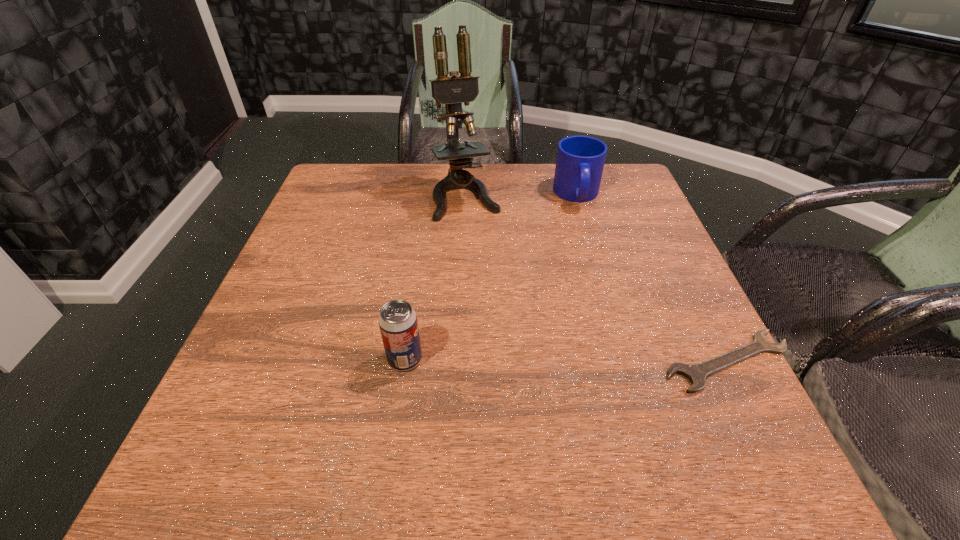
Where is `vacant position located 0.120m on the side with the handle of the second object from right to left`? The height and width of the screenshot is (540, 960). vacant position located 0.120m on the side with the handle of the second object from right to left is located at coordinates (587, 242).

Locate an element on the screen. The height and width of the screenshot is (540, 960). vacant position located 0.180m on the side with the handle of the second object from right to left is located at coordinates [x=589, y=259].

Where is `vacant position located 0.060m on the side with the handle of the second object from right to left`? This screenshot has width=960, height=540. vacant position located 0.060m on the side with the handle of the second object from right to left is located at coordinates (584, 227).

What are the coordinates of `microscope at the far edge` in the screenshot? It's located at (452, 91).

Locate an element on the screen. The height and width of the screenshot is (540, 960). mug located at the far edge is located at coordinates (580, 160).

Find the location of a particular element. object at the near edge is located at coordinates (696, 373).

This screenshot has height=540, width=960. I want to click on wrench at the right edge, so click(696, 373).

At what (x,y) coordinates should I click in order to perform the action: click on mug at the right edge. Please return your answer as a coordinate pair (x, y). The image size is (960, 540). Looking at the image, I should click on coord(580,160).

Identify the location of object located at the far right corner. (580, 160).

Where is `object located in the near right corner section of the desktop`? This screenshot has width=960, height=540. object located in the near right corner section of the desktop is located at coordinates (696, 373).